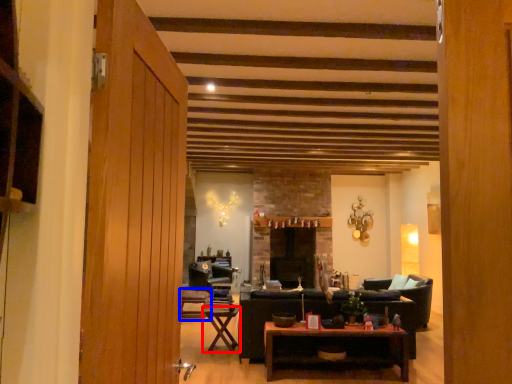
Question: Which point is further to the camera, table (highlighted by a red box) or chair (highlighted by a blue box)?

Choices:
 (A) table
 (B) chair

Answer: (B)